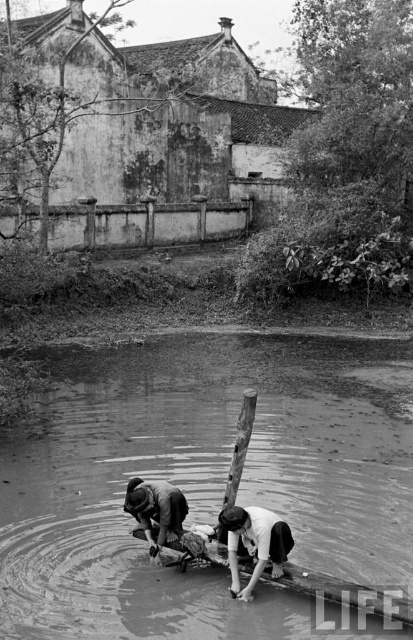
Does wooden canoe at lower center have a lesser height compared to smooth white shirt at lower center?

Correct, wooden canoe at lower center is not as tall as smooth white shirt at lower center.

Who is taller, wooden canoe at lower center or smooth white shirt at lower center?

smooth white shirt at lower center

Is point (401, 616) positioned behind point (235, 582)?

No, (401, 616) is closer to viewer.

Image resolution: width=413 pixels, height=640 pixels. I want to click on wooden canoe at lower center, so click(344, 593).

Can you confirm if smooth water at center is shorter than wooden canoe at lower center?

No, smooth water at center is not shorter than wooden canoe at lower center.

Who is positioned more to the left, smooth water at center or wooden canoe at lower center?

smooth water at center

What do you see at coordinates (206, 481) in the screenshot? I see `smooth water at center` at bounding box center [206, 481].

Where is `smooth water at center`? The image size is (413, 640). smooth water at center is located at coordinates (206, 481).

Looking at this image, is smooth water at center to the right of smooth white shirt at lower center from the viewer's perspective?

No, smooth water at center is not to the right of smooth white shirt at lower center.

Is point (258, 616) farther from viewer compared to point (277, 554)?

No, it is in front of (277, 554).

Identify the location of smooth water at center. The height and width of the screenshot is (640, 413). [206, 481].